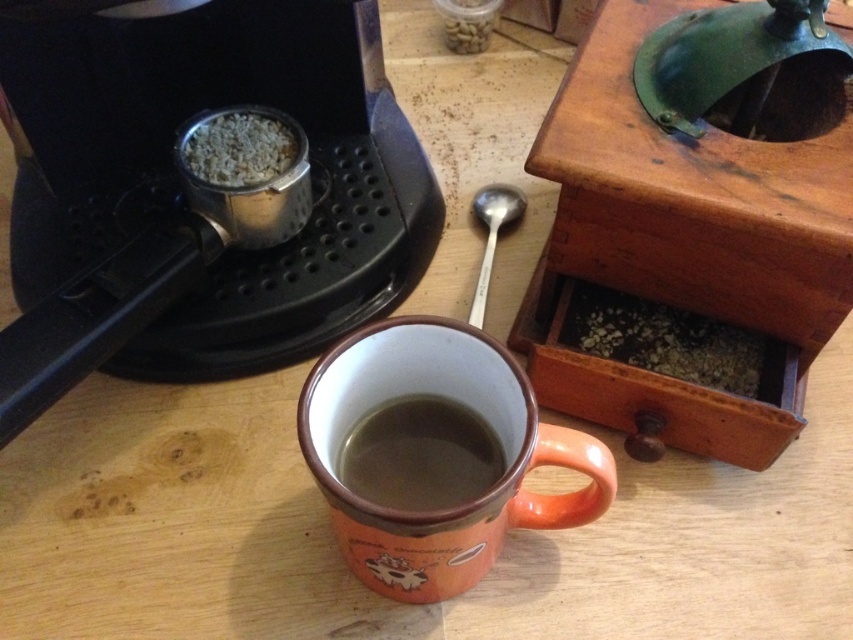
Does black plastic coffee machine at upper left have a lesser width compared to brown matte mug at center?

In fact, black plastic coffee machine at upper left might be wider than brown matte mug at center.

Does black plastic coffee machine at upper left appear on the right side of brown matte mug at center?

Incorrect, black plastic coffee machine at upper left is not on the right side of brown matte mug at center.

In order to click on black plastic coffee machine at upper left in this screenshot , I will do `click(186, 200)`.

Which of these two, wooden box at right or orange ceramic mug at center, stands taller?

wooden box at right

Between point (815, 298) and point (401, 449), which one is positioned in front?

Point (815, 298) is more forward.

Which is behind, point (579, 112) or point (355, 572)?

Point (355, 572)

Locate an element on the screen. wooden box at right is located at coordinates [689, 248].

Consider the image. Does orange ceramic mug at center come in front of brown matte mug at center?

That is True.

Between orange ceramic mug at center and brown matte mug at center, which one appears on the right side from the viewer's perspective?

orange ceramic mug at center

Describe the element at coordinates (434, 454) in the screenshot. I see `orange ceramic mug at center` at that location.

Locate an element on the screen. The width and height of the screenshot is (853, 640). orange ceramic mug at center is located at coordinates (434, 454).